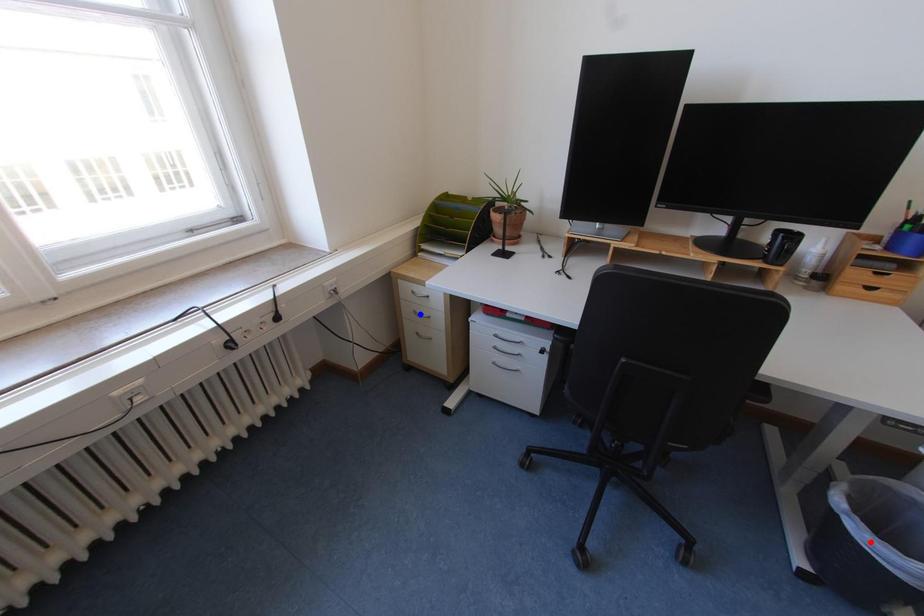
Question: Which of the two points in the image is closer to the camera?

Choices:
 (A) Blue point is closer.
 (B) Red point is closer.

Answer: (B)